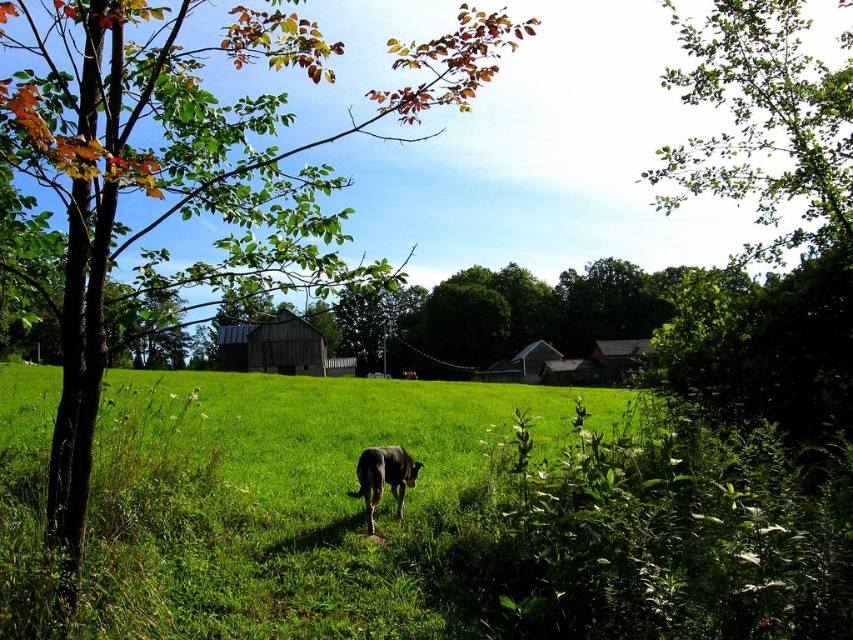
You are standing in the field and want to walk from the green leafy tree at upper right to the dark brown wooden barn at center. Which direction should you head to get there?

To reach the dark brown wooden barn at center from the green leafy tree at upper right, you should head towards the center of the field since the barn is further away from the viewer compared to the tree.

You are standing in the field and want to reach the point marked as point [753,88]. If you walk straight ahead, will you reach it before the dog, which is walking away from you towards the center of the field?

The point [753,88] is 7.72 meters away from the viewer. Since the dog is already moving away from the viewer towards the center of the field, the dog will reach the point [753,88] before the viewer does.